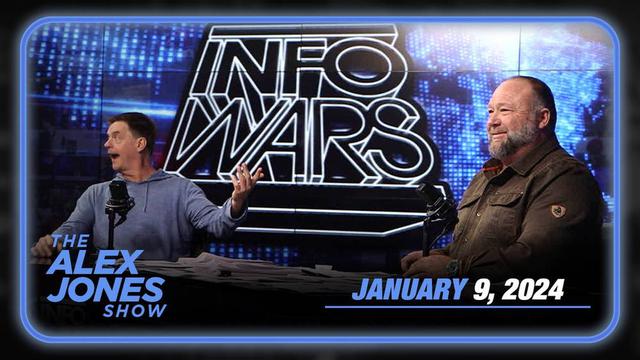
Find the location of a particular element. The width and height of the screenshot is (640, 360). papers on desk is located at coordinates (221, 259).